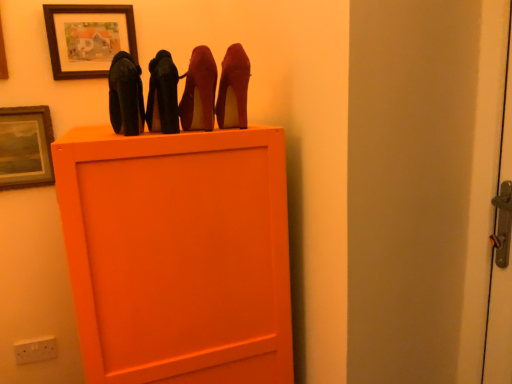
Question: Is white plastic electric outlet at lower left facing away from wooden picture frame at upper left, which is the second picture frame from right to left?

Choices:
 (A) yes
 (B) no

Answer: (B)

Question: Is white plastic electric outlet at lower left facing towards wooden picture frame at upper left, the first picture frame from the left?

Choices:
 (A) no
 (B) yes

Answer: (A)

Question: From the image's perspective, would you say white plastic electric outlet at lower left is positioned over wooden picture frame at upper left, which is the second picture frame from right to left?

Choices:
 (A) no
 (B) yes

Answer: (A)

Question: Could wooden picture frame at upper left, the first picture frame from the left, be considered to be inside white plastic electric outlet at lower left?

Choices:
 (A) yes
 (B) no

Answer: (B)

Question: Is white plastic electric outlet at lower left placed right next to wooden picture frame at upper left, which is the second picture frame from right to left?

Choices:
 (A) no
 (B) yes

Answer: (A)

Question: Is white plastic electric outlet at lower left inside the boundaries of matte black high heels at upper center, the fourth high heels when ordered from right to left, or outside?

Choices:
 (A) outside
 (B) inside

Answer: (A)

Question: From their relative heights in the image, would you say white plastic electric outlet at lower left is taller or shorter than matte black high heels at upper center, the fourth high heels when ordered from right to left?

Choices:
 (A) tall
 (B) short

Answer: (B)

Question: Considering the relative positions of white plastic electric outlet at lower left and matte black high heels at upper center, the 1th high heels viewed from the left, in the image provided, is white plastic electric outlet at lower left to the left or to the right of matte black high heels at upper center, the 1th high heels viewed from the left,?

Choices:
 (A) right
 (B) left

Answer: (B)

Question: Is white plastic electric outlet at lower left bigger or smaller than matte black high heels at upper center, the 1th high heels viewed from the left?

Choices:
 (A) small
 (B) big

Answer: (A)

Question: Would you say wooden picture frame at upper left, which is the second picture frame from right to left, is inside or outside white plastic electric outlet at lower left?

Choices:
 (A) outside
 (B) inside

Answer: (A)

Question: Considering their positions, is wooden picture frame at upper left, the 1th picture frame in the bottom-to-top sequence, located in front of or behind white plastic electric outlet at lower left?

Choices:
 (A) behind
 (B) front

Answer: (B)

Question: Does point (34, 152) appear closer or farther from the camera than point (54, 337)?

Choices:
 (A) closer
 (B) farther

Answer: (A)

Question: Is wooden picture frame at upper left, the second picture frame viewed from the top, to the left or to the right of white plastic electric outlet at lower left in the image?

Choices:
 (A) right
 (B) left

Answer: (B)

Question: Based on their positions, is suede-like red high heels at upper center, acting as the fourth high heels starting from the left, located to the left or right of matte wooden picture frame at upper center, the 1th picture frame in the right-to-left sequence?

Choices:
 (A) right
 (B) left

Answer: (A)

Question: From a real-world perspective, relative to matte wooden picture frame at upper center, which is the second picture frame in bottom-to-top order, is suede-like red high heels at upper center, acting as the fourth high heels starting from the left, vertically above or below?

Choices:
 (A) above
 (B) below

Answer: (B)